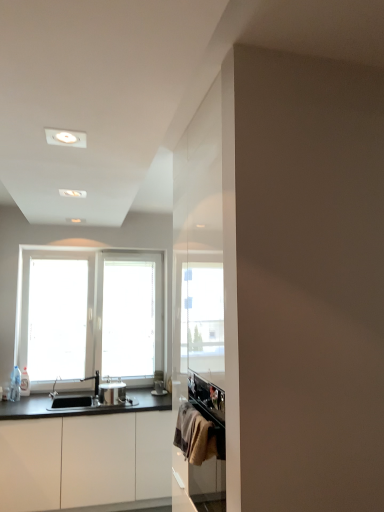
Question: Is textured beige towel at lower right completely or partially inside clear glass bottle at left?

Choices:
 (A) yes
 (B) no

Answer: (B)

Question: Is clear glass bottle at left turned away from textured beige towel at lower right?

Choices:
 (A) yes
 (B) no

Answer: (B)

Question: From a real-world perspective, is clear glass bottle at left physically below textured beige towel at lower right?

Choices:
 (A) yes
 (B) no

Answer: (A)

Question: Does clear glass bottle at left appear on the left side of textured beige towel at lower right?

Choices:
 (A) no
 (B) yes

Answer: (B)

Question: Is clear glass bottle at left not inside textured beige towel at lower right?

Choices:
 (A) yes
 (B) no

Answer: (A)

Question: Is clear glass bottle at left behind textured beige towel at lower right?

Choices:
 (A) yes
 (B) no

Answer: (A)

Question: From a real-world perspective, is white matte cabinet at lower left over satin nickel faucet at sink left?

Choices:
 (A) no
 (B) yes

Answer: (A)

Question: Is white matte cabinet at lower left looking in the opposite direction of satin nickel faucet at sink left?

Choices:
 (A) yes
 (B) no

Answer: (B)

Question: Would you say satin nickel faucet at sink left is part of white matte cabinet at lower left's contents?

Choices:
 (A) no
 (B) yes

Answer: (A)

Question: Is white matte cabinet at lower left positioned beyond the bounds of satin nickel faucet at sink left?

Choices:
 (A) yes
 (B) no

Answer: (A)

Question: Does white matte cabinet at lower left lie behind satin nickel faucet at sink left?

Choices:
 (A) yes
 (B) no

Answer: (B)

Question: Considering the relative sizes of white matte cabinet at lower left and satin nickel faucet at sink left in the image provided, is white matte cabinet at lower left shorter than satin nickel faucet at sink left?

Choices:
 (A) yes
 (B) no

Answer: (B)

Question: From the image's perspective, would you say clear glass bottle at left is shown under satin nickel faucet at sink left?

Choices:
 (A) no
 (B) yes

Answer: (A)